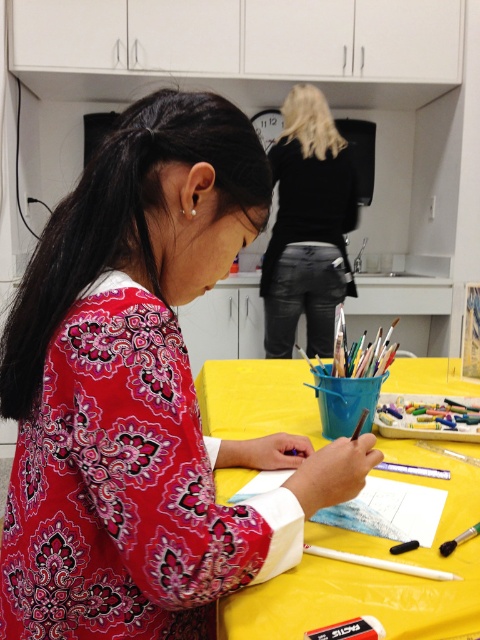
You are an art student who needs to place a large canvas between the yellow fabric table at center and the black leather jacket at upper center. Is this possible given their spatial arrangement?

The yellow fabric table at center is in front of the black leather jacket at upper center, so there is no space between them for placing a large canvas.

You are an art teacher observing the classroom. You notice the patterned fabric shirt at center and the yellow fabric table at center. Which object is positioned to the left of the other?

The patterned fabric shirt at center is to the left of the yellow fabric table at center.